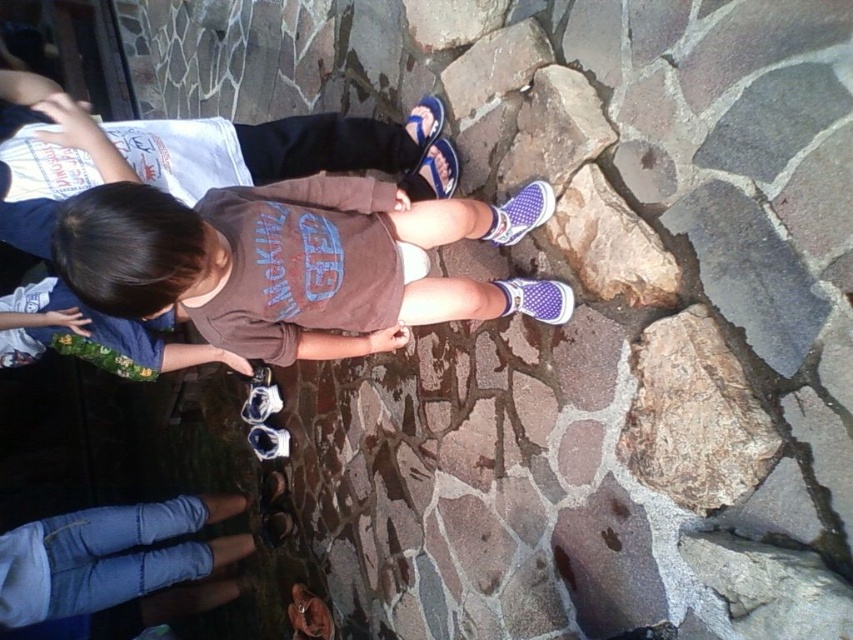
You are a photographer trying to capture both points in the image. Which point, point (x=193, y=240) or point (x=413, y=257), is closer to your camera lens?

Point (x=193, y=240) is closer to the camera lens than point (x=413, y=257).

Where is the brown cotton shirt at center located in the image?

The brown cotton shirt at center is located at point 0.406 on the x axis and 0.332 on the y axis.